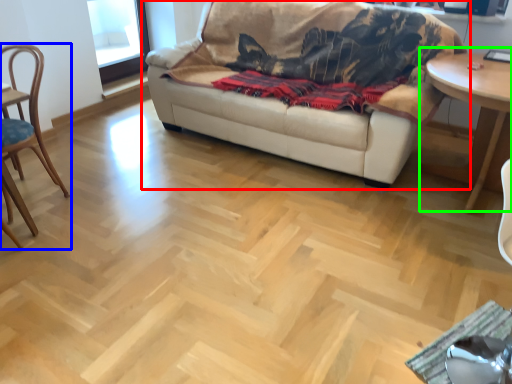
Question: Which object is the farthest from studio couch (highlighted by a red box)? Choose among these: chair (highlighted by a blue box) or table (highlighted by a green box).

Choices:
 (A) chair
 (B) table

Answer: (A)